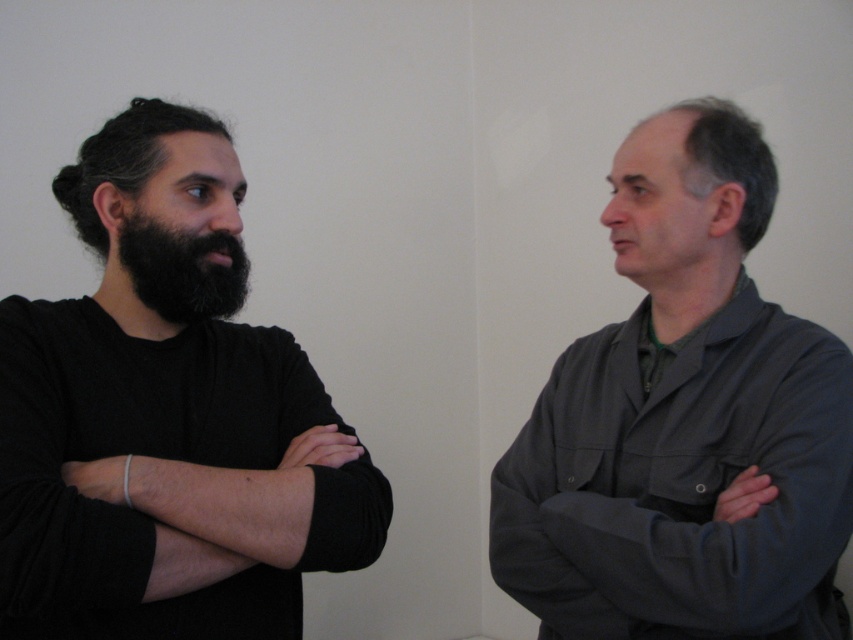
Does black knitted sweater at left have a lesser width compared to dark gray fabric shirt at right?

Yes.

Does black knitted sweater at left have a smaller size compared to dark gray fabric shirt at right?

Yes.

The image size is (853, 640). I want to click on black knitted sweater at left, so click(x=167, y=417).

Between dark gray fabric shirt at right and black fuzzy beard at left, which one has less height?

black fuzzy beard at left

Is dark gray fabric shirt at right wider than black fuzzy beard at left?

Yes, dark gray fabric shirt at right is wider than black fuzzy beard at left.

I want to click on dark gray fabric shirt at right, so click(683, 422).

The height and width of the screenshot is (640, 853). Identify the location of dark gray fabric shirt at right. (683, 422).

Is point (257, 545) farther from viewer compared to point (236, 280)?

No, (257, 545) is closer to viewer.

The height and width of the screenshot is (640, 853). I want to click on black knitted sweater at left, so (x=167, y=417).